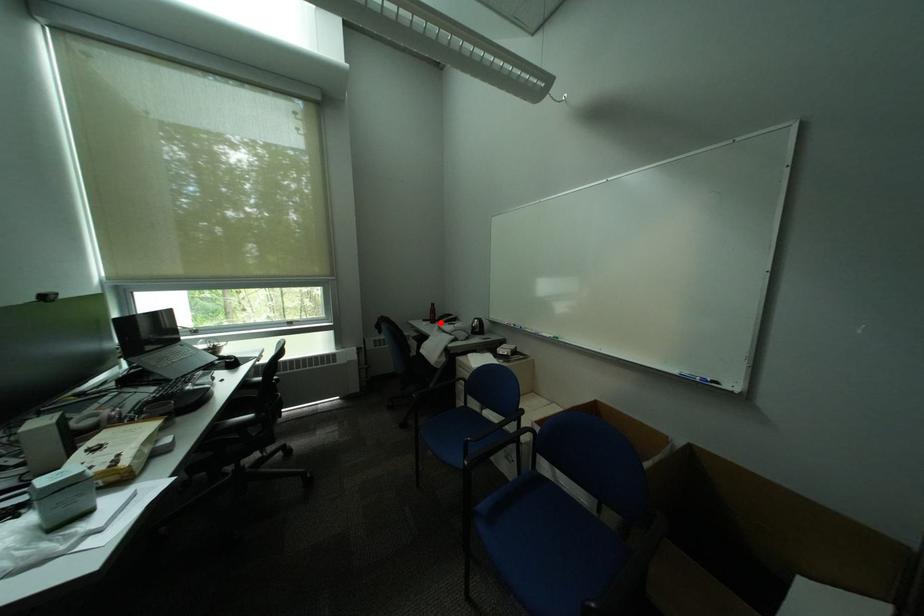
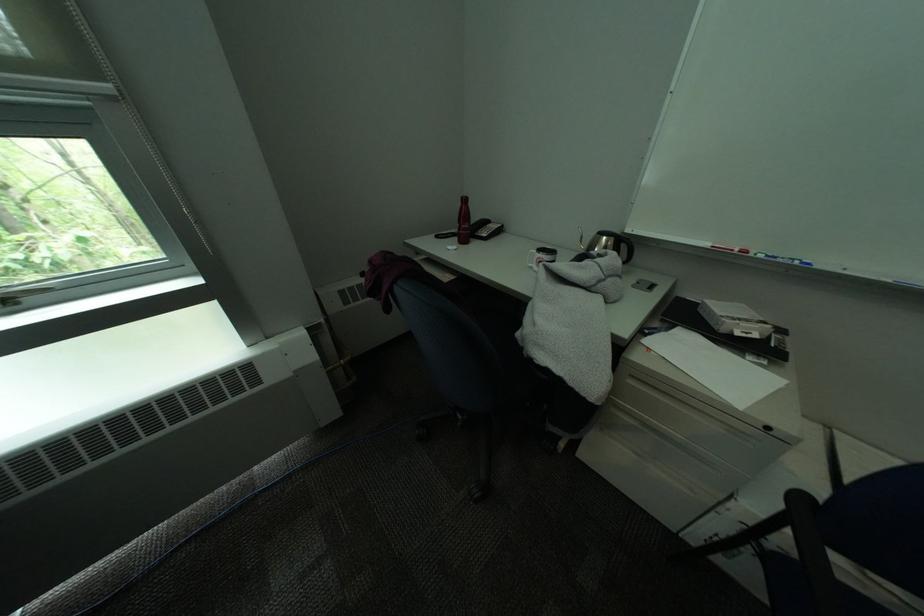
Find the pixel in the second image that matches the highlighted location in the first image.

(466, 241)